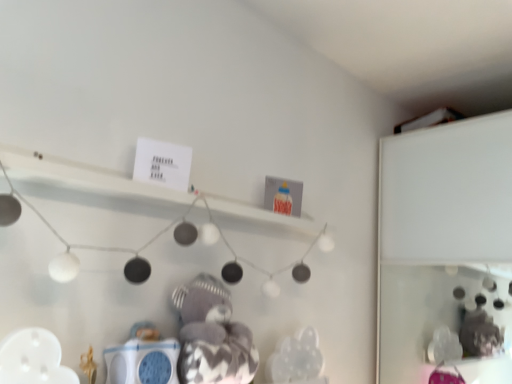
Question: Should I look upward or downward to see fluffy gray teddy bear at center?

Choices:
 (A) up
 (B) down

Answer: (B)